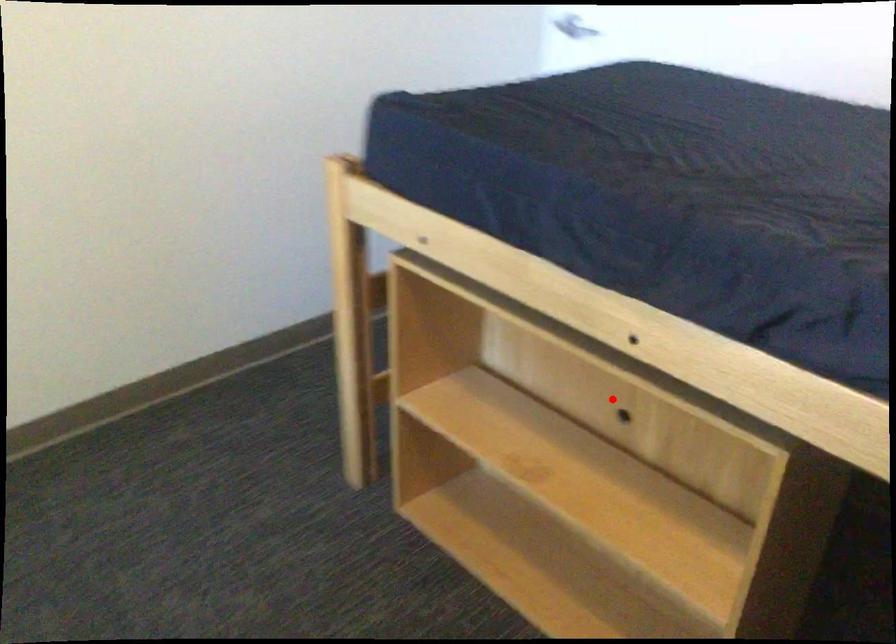
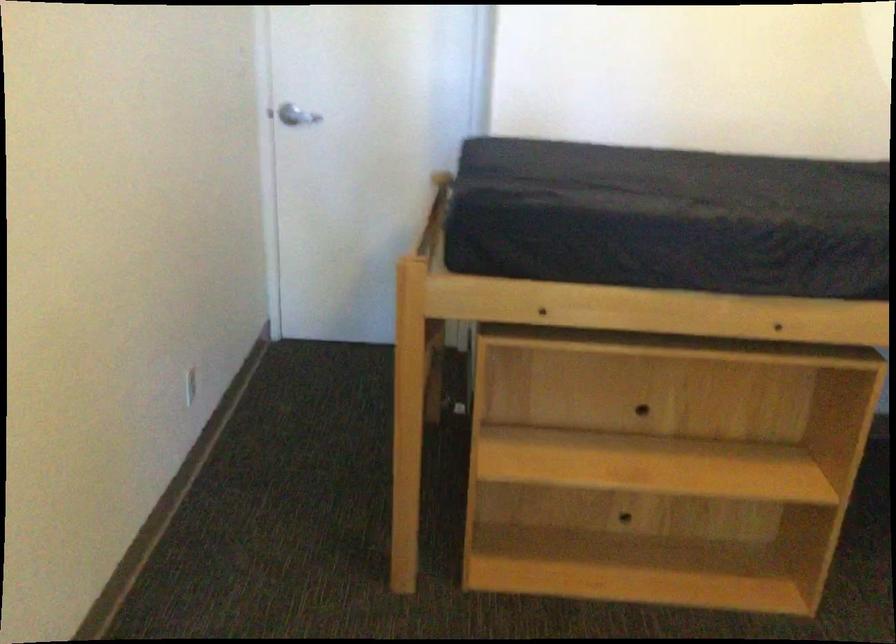
Question: I am providing you with two images of the same scene from different viewpoints. A red point is shown in image1. For the corresponding object point in image2, is it positioned nearer or farther from the camera?

Choices:
 (A) Nearer
 (B) Farther

Answer: (B)